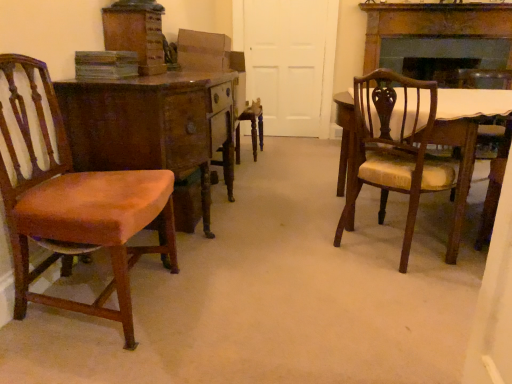
I want to click on vacant space in front of wooden desk at left, so click(x=243, y=304).